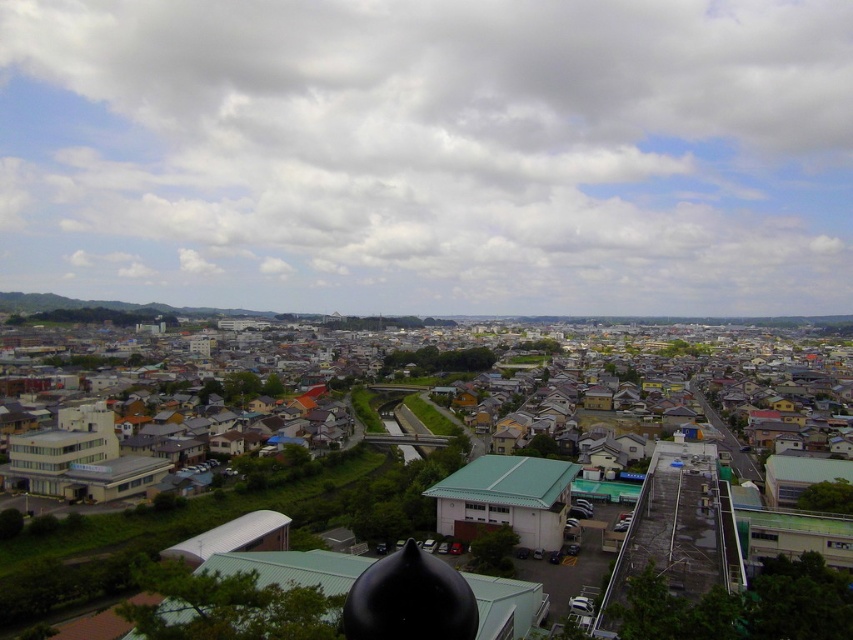
Who is positioned more to the left, white fluffy cloud at upper center or matte gray building at center?

From the viewer's perspective, white fluffy cloud at upper center appears more on the left side.

Who is taller, white fluffy cloud at upper center or matte gray building at center?

Standing taller between the two is white fluffy cloud at upper center.

Does point (177, 262) come in front of point (772, 618)?

No, (177, 262) is further to viewer.

Locate an element on the screen. The width and height of the screenshot is (853, 640). white fluffy cloud at upper center is located at coordinates (430, 154).